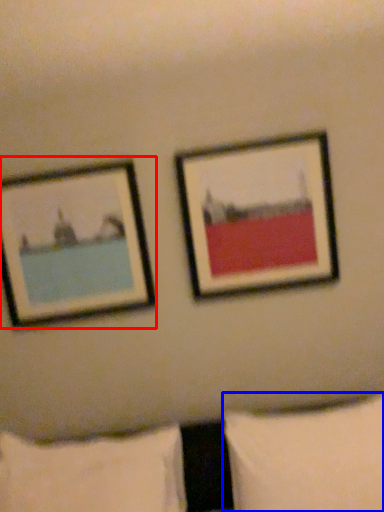
Question: Which of the following is the closest to the observer, picture frame (highlighted by a red box) or pillow (highlighted by a blue box)?

Choices:
 (A) picture frame
 (B) pillow

Answer: (B)